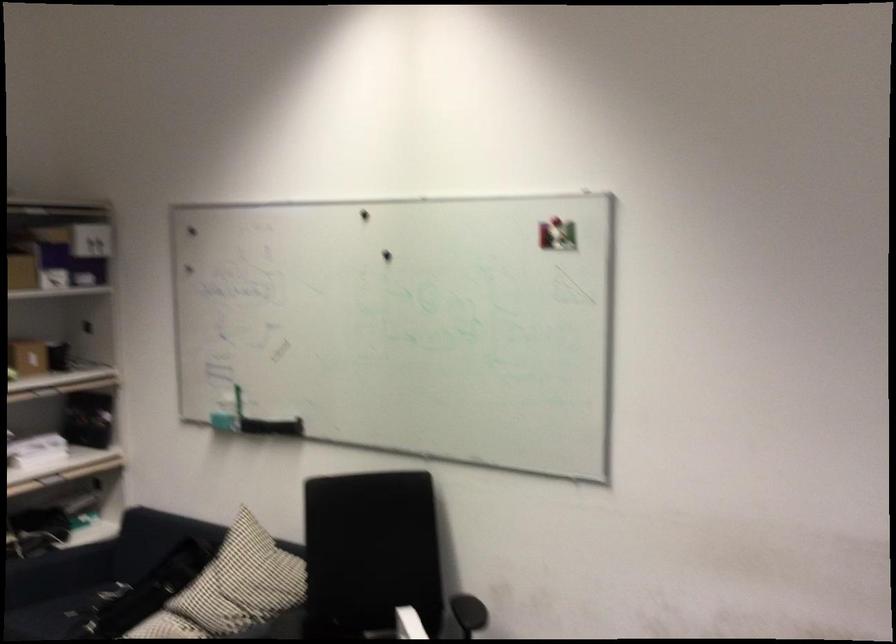
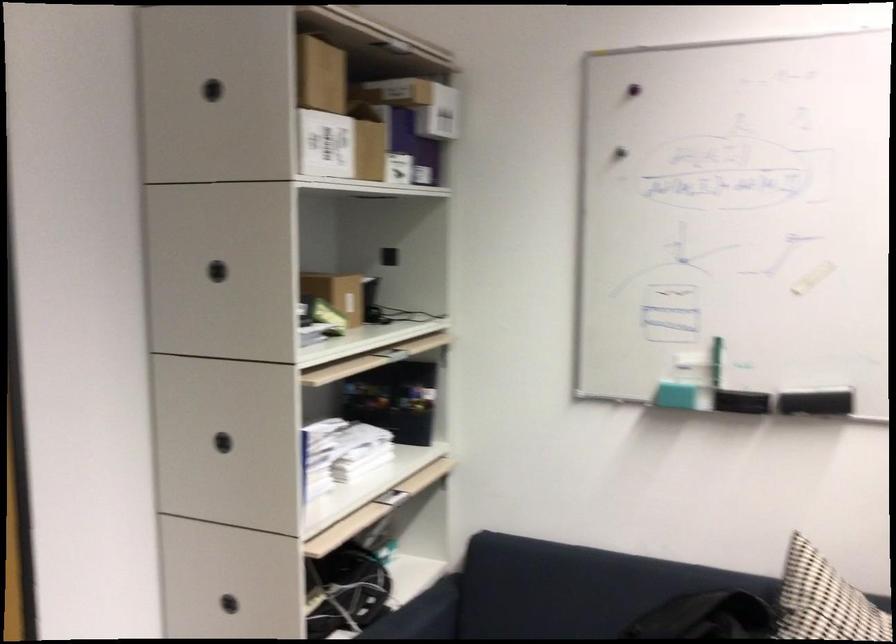
The point at [142,563] is marked in the first image. Where is the corresponding point in the second image?

(533, 625)